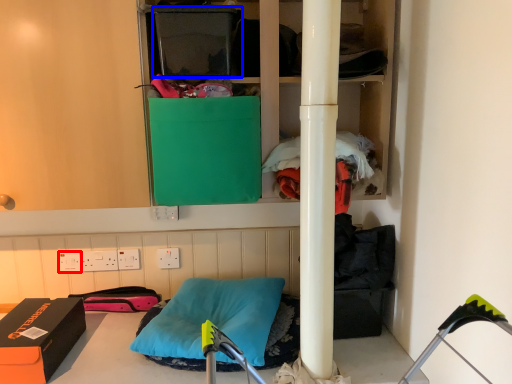
Question: Which object appears closest to the camera in this image, electric outlet (highlighted by a red box) or box (highlighted by a blue box)?

Choices:
 (A) electric outlet
 (B) box

Answer: (B)